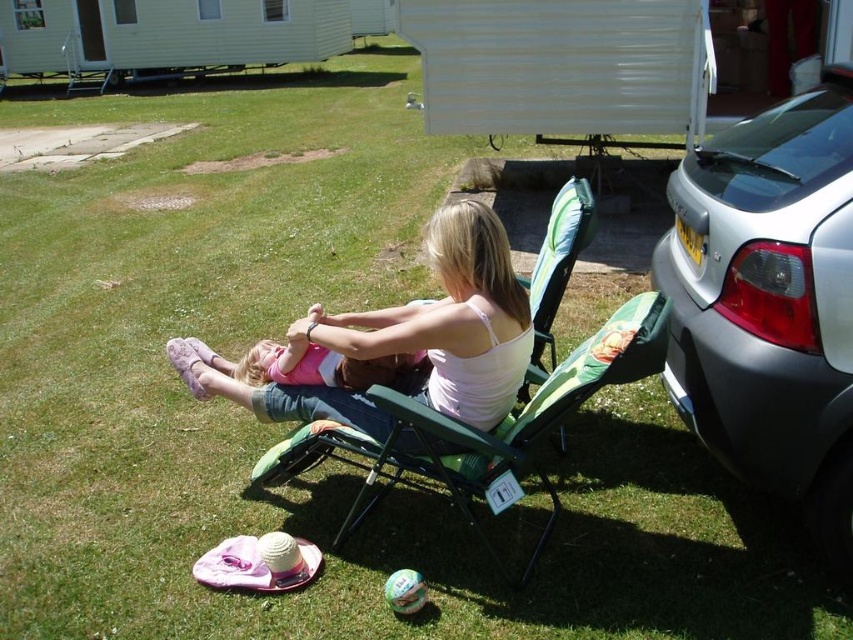
Consider the image. You are standing at the center of the caravan park and see the silver metallic car at right and the green fabric chair at center. Which object is positioned further to the east?

The silver metallic car at right is positioned further to the east since it is to the right of the green fabric chair at center, and assuming the observer is facing north in the caravan park.